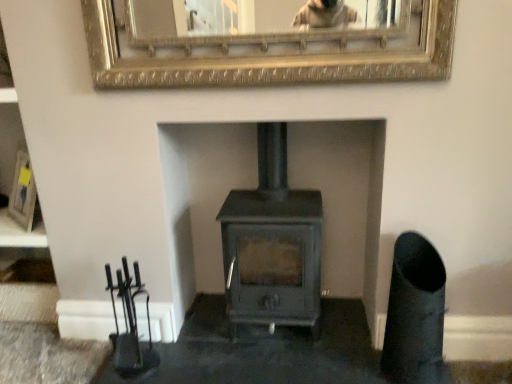
Question: Is matte black picture frame at left, the first picture frame in the left-to-right sequence, wider or thinner than matte gray wood burning stove at center?

Choices:
 (A) thin
 (B) wide

Answer: (A)

Question: From the image's perspective, is matte black picture frame at left, the 2th picture frame positioned from the front, positioned above or below matte gray wood burning stove at center?

Choices:
 (A) above
 (B) below

Answer: (A)

Question: Which object is positioned farthest from the matte black picture frame at left, the first picture frame in the left-to-right sequence?

Choices:
 (A) matte gray wood burning stove at center
 (B) gold textured mirror at upper center, which appears as the first picture frame when viewed from the right

Answer: (B)

Question: Which object is positioned closest to the gold textured mirror at upper center, the first picture frame viewed from the top?

Choices:
 (A) matte gray wood burning stove at center
 (B) matte black picture frame at left, placed as the 2th picture frame when sorted from top to bottom

Answer: (A)